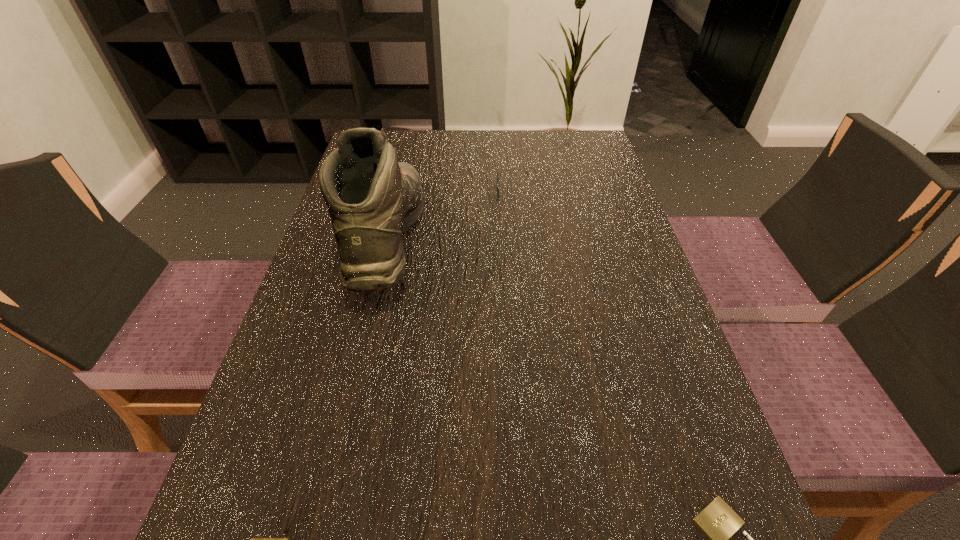
Where is `the tallest object`? Image resolution: width=960 pixels, height=540 pixels. the tallest object is located at coordinates tap(372, 199).

This screenshot has height=540, width=960. Identify the location of the third object from left to right. (498, 192).

Where is `the third shortest object`? The image size is (960, 540). the third shortest object is located at coordinates (498, 192).

You are a GUI agent. You are given a task and a screenshot of the screen. Output one action in this format:
    pyautogui.click(x=<x>, y=<y>)
    Task: Click on the free space located on the right of the ski boot
    Image resolution: width=960 pixels, height=540 pixels.
    Given the screenshot: What is the action you would take?
    pyautogui.click(x=447, y=240)

Where is `free location located on the lenses of the third object from left to right`? The image size is (960, 540). free location located on the lenses of the third object from left to right is located at coordinates (374, 192).

At what (x,y) coordinates should I click in order to perform the action: click on free location located on the lenses of the third object from left to right. Please return your answer as a coordinate pair (x, y). This screenshot has height=540, width=960. Looking at the image, I should click on (401, 192).

I want to click on vacant region located 0.290m on the lenses of the third object from left to right, so click(386, 192).

Find the location of a particular element. object that is at the left edge is located at coordinates (372, 199).

In order to click on vacant space at the far edge of the desktop in this screenshot , I will do `click(487, 147)`.

At what (x,y) coordinates should I click in order to perform the action: click on free spot at the left edge of the desktop. Please return your answer as a coordinate pair (x, y). Looking at the image, I should click on (285, 355).